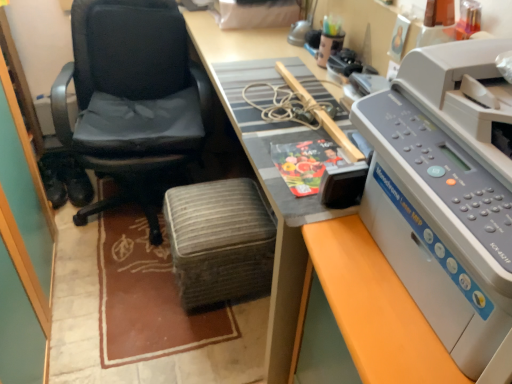
Question: Considering the relative sizes of black leather chair at left and woven fabric stool at center in the image provided, is black leather chair at left thinner than woven fabric stool at center?

Choices:
 (A) yes
 (B) no

Answer: (B)

Question: Is black leather chair at left smaller than woven fabric stool at center?

Choices:
 (A) no
 (B) yes

Answer: (A)

Question: Considering the relative positions of black leather chair at left and woven fabric stool at center in the image provided, is black leather chair at left to the right of woven fabric stool at center from the viewer's perspective?

Choices:
 (A) no
 (B) yes

Answer: (A)

Question: Considering the relative positions of black leather chair at left and woven fabric stool at center in the image provided, is black leather chair at left to the left of woven fabric stool at center from the viewer's perspective?

Choices:
 (A) yes
 (B) no

Answer: (A)

Question: From the image's perspective, would you say black leather chair at left is shown under woven fabric stool at center?

Choices:
 (A) yes
 (B) no

Answer: (B)

Question: From a real-world perspective, is black leather chair at left positioned above or below wooden desk at center?

Choices:
 (A) below
 (B) above

Answer: (A)

Question: From the image's perspective, is black leather chair at left positioned above or below wooden desk at center?

Choices:
 (A) below
 (B) above

Answer: (B)

Question: Visually, is black leather chair at left positioned to the left or to the right of wooden desk at center?

Choices:
 (A) right
 (B) left

Answer: (B)

Question: Is black leather chair at left wider or thinner than wooden desk at center?

Choices:
 (A) thin
 (B) wide

Answer: (B)

Question: In terms of width, does gray plastic printer at right look wider or thinner when compared to woven fabric stool at center?

Choices:
 (A) wide
 (B) thin

Answer: (A)

Question: Is gray plastic printer at right situated inside woven fabric stool at center or outside?

Choices:
 (A) inside
 (B) outside

Answer: (B)

Question: From a real-world perspective, is gray plastic printer at right positioned above or below woven fabric stool at center?

Choices:
 (A) above
 (B) below

Answer: (A)

Question: Considering the relative positions of gray plastic printer at right and woven fabric stool at center in the image provided, is gray plastic printer at right to the left or to the right of woven fabric stool at center?

Choices:
 (A) left
 (B) right

Answer: (B)

Question: Does point pyautogui.click(x=291, y=248) appear closer or farther from the camera than point pyautogui.click(x=230, y=256)?

Choices:
 (A) farther
 (B) closer

Answer: (B)

Question: Considering the positions of wooden desk at center and woven fabric stool at center in the image, is wooden desk at center taller or shorter than woven fabric stool at center?

Choices:
 (A) tall
 (B) short

Answer: (A)